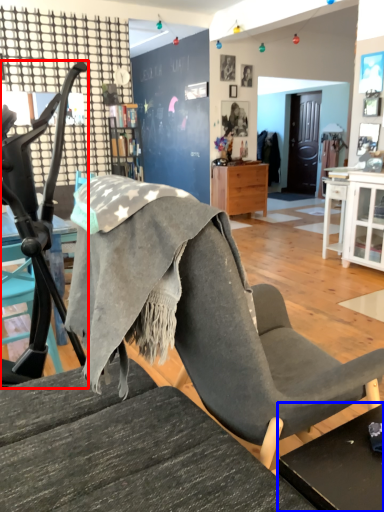
Question: Which point is further to the camera, chair (highlighted by a red box) or table (highlighted by a blue box)?

Choices:
 (A) chair
 (B) table

Answer: (A)